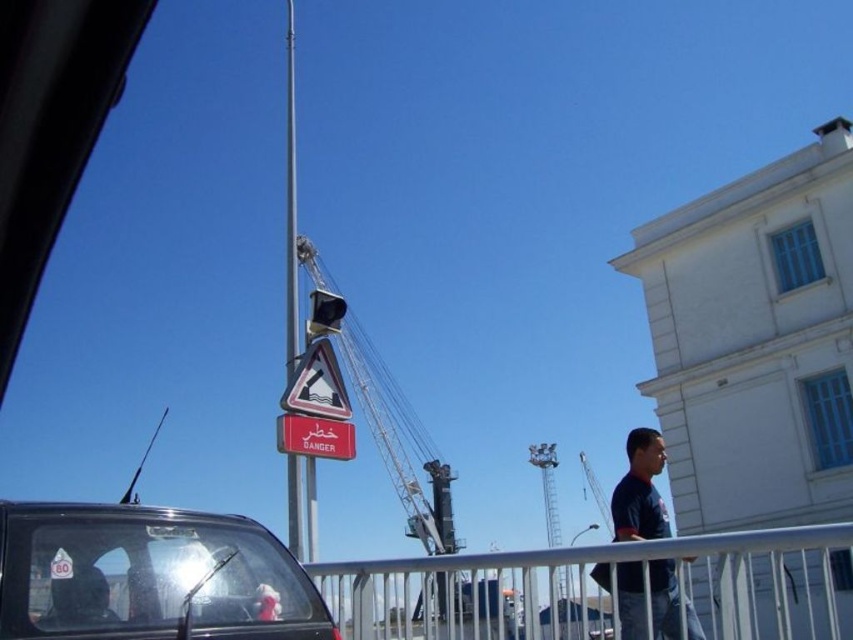
Which is in front, point (192, 522) or point (335, 456)?

Point (192, 522) is more forward.

Which is more to the right, clear glass car at lower left or red matte sign at center?

clear glass car at lower left

Describe the element at coordinates (149, 576) in the screenshot. I see `clear glass car at lower left` at that location.

Locate an element on the screen. Image resolution: width=853 pixels, height=640 pixels. clear glass car at lower left is located at coordinates (149, 576).

Is point (514, 564) farther from viewer compared to point (42, 588)?

That is True.

Who is taller, white metallic rail at center or clear glass car at lower left?

white metallic rail at center

You are a GUI agent. You are given a task and a screenshot of the screen. Output one action in this format:
    pyautogui.click(x=<x>, y=<y>)
    Task: Click on the white metallic rail at center
    
    Given the screenshot: What is the action you would take?
    tap(596, 589)

Can you confirm if clear glass car at lower left is positioned above dark blue t-shirt at center?

Yes.

Which of these two, clear glass car at lower left or dark blue t-shirt at center, stands taller?

dark blue t-shirt at center is taller.

Describe the element at coordinates (149, 576) in the screenshot. I see `clear glass car at lower left` at that location.

Locate an element on the screen. The height and width of the screenshot is (640, 853). clear glass car at lower left is located at coordinates (149, 576).